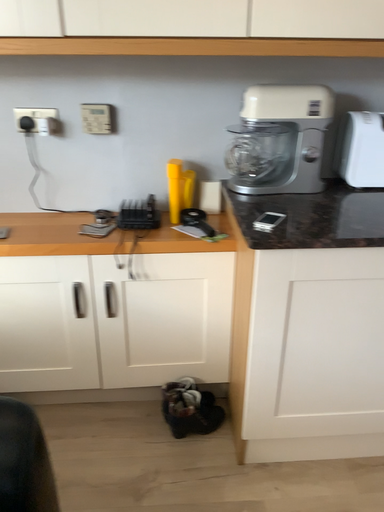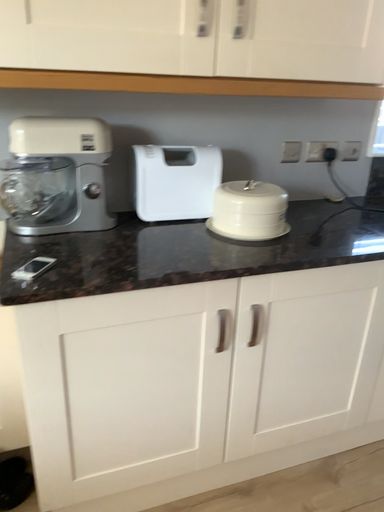
Question: Which way did the camera rotate in the video?

Choices:
 (A) rotated right
 (B) rotated left

Answer: (A)